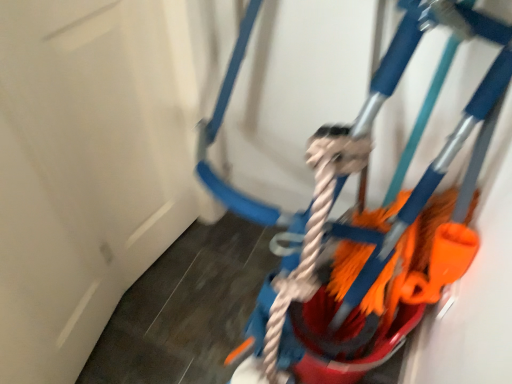
Question: From a real-world perspective, is orange fabric mop at right physically located above or below white matte door at upper left?

Choices:
 (A) below
 (B) above

Answer: (A)

Question: Is orange fabric mop at right bigger or smaller than white matte door at upper left?

Choices:
 (A) big
 (B) small

Answer: (A)

Question: In the image, is orange fabric mop at right on the left side or the right side of white matte door at upper left?

Choices:
 (A) left
 (B) right

Answer: (B)

Question: In terms of size, does white matte door at upper left appear bigger or smaller than orange fabric mop at right?

Choices:
 (A) big
 (B) small

Answer: (B)

Question: From the image's perspective, is white matte door at upper left positioned above or below orange fabric mop at right?

Choices:
 (A) above
 (B) below

Answer: (B)

Question: From a real-world perspective, is white matte door at upper left physically located above or below orange fabric mop at right?

Choices:
 (A) below
 (B) above

Answer: (B)

Question: Considering the relative positions of white matte door at upper left and orange fabric mop at right in the image provided, is white matte door at upper left to the left or to the right of orange fabric mop at right?

Choices:
 (A) left
 (B) right

Answer: (A)